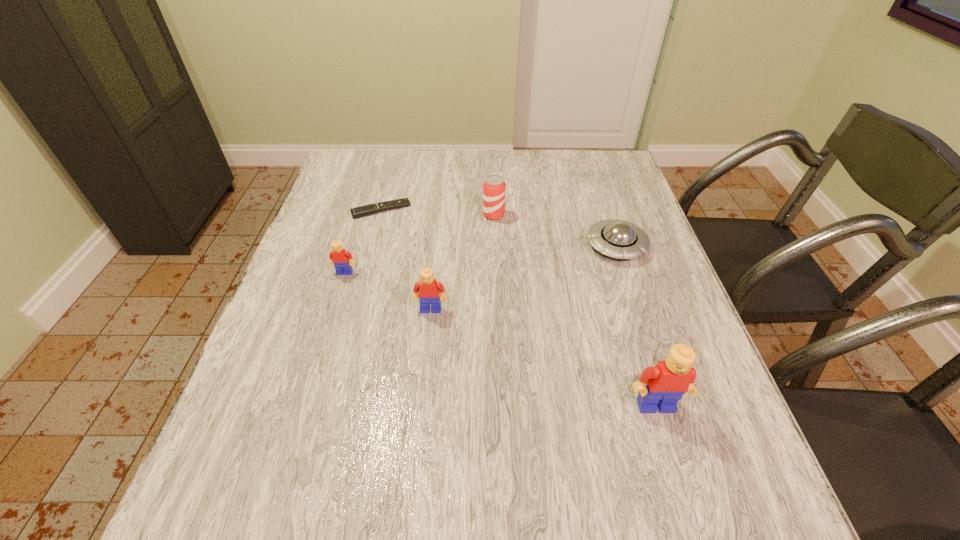
At what (x,y) coordinates should I click in order to perform the action: click on object that is at the near right corner. Please return your answer as a coordinate pair (x, y). This screenshot has width=960, height=540. Looking at the image, I should click on (661, 387).

Locate an element on the screen. The image size is (960, 540). vacant space at the far edge of the desktop is located at coordinates tap(543, 182).

The image size is (960, 540). In the image, there is a desktop. Find the location of `vacant space at the left edge`. vacant space at the left edge is located at coordinates (302, 330).

Find the location of `vacant area at the right edge of the desktop`. vacant area at the right edge of the desktop is located at coordinates (640, 322).

Locate an element on the screen. This screenshot has width=960, height=540. free space at the near left corner is located at coordinates (x=308, y=421).

Locate an element on the screen. The height and width of the screenshot is (540, 960). vacant area at the far right corner of the desktop is located at coordinates (612, 172).

Identify the location of vacant area between the fourth object from left to right and the shortest object. (438, 212).

I want to click on vacant space that is in between the nearest object and the farthest Lego, so click(x=500, y=339).

The width and height of the screenshot is (960, 540). In order to click on free space between the nearest Lego and the shortest Lego in this screenshot , I will do pos(500,339).

Where is `free point between the leftmost Lego and the fifth tallest object`? Image resolution: width=960 pixels, height=540 pixels. free point between the leftmost Lego and the fifth tallest object is located at coordinates (481, 259).